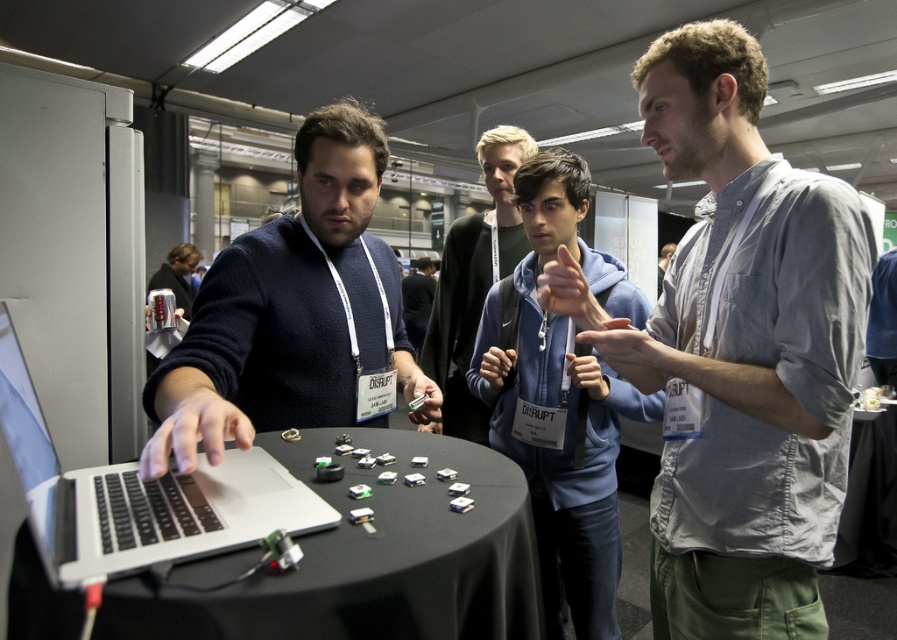
You are a participant at the tech event and need to place a 25 cm long component on the table. Can you fit it between the black fabric table at center and the dark blue sweater at center without moving either?

The distance between the black fabric table at center and the dark blue sweater at center is 26.33 centimeters. Since the component is 25 cm long, it can fit within the available space.

You are a photographer standing at the back of the conference hall. You want to take a photo of the gray cotton shirt at center and the black fabric table at center. Which object will be more visible in the foreground of your photo?

The gray cotton shirt at center will be more visible in the foreground because it has a greater height compared to the black fabric table at center, making it stand out more in the photo.